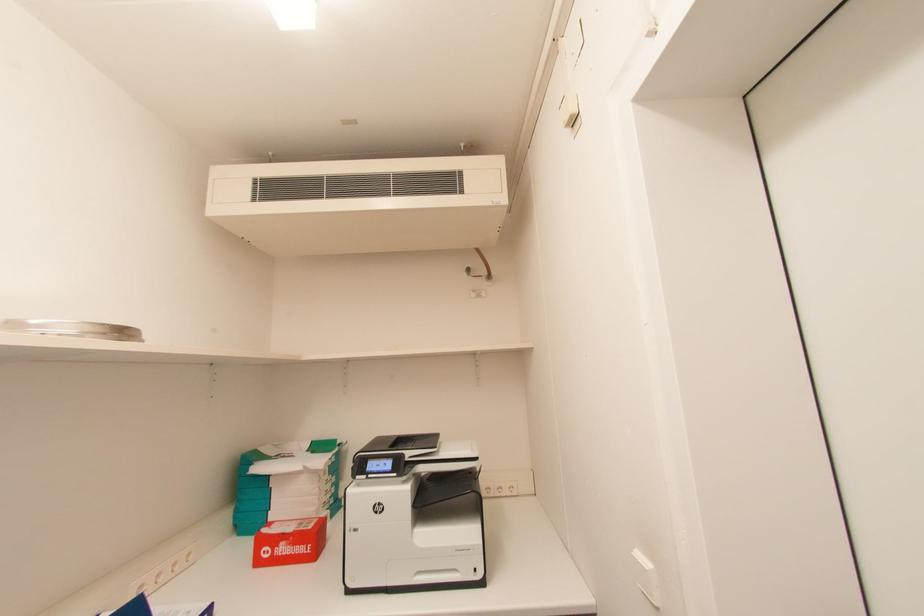
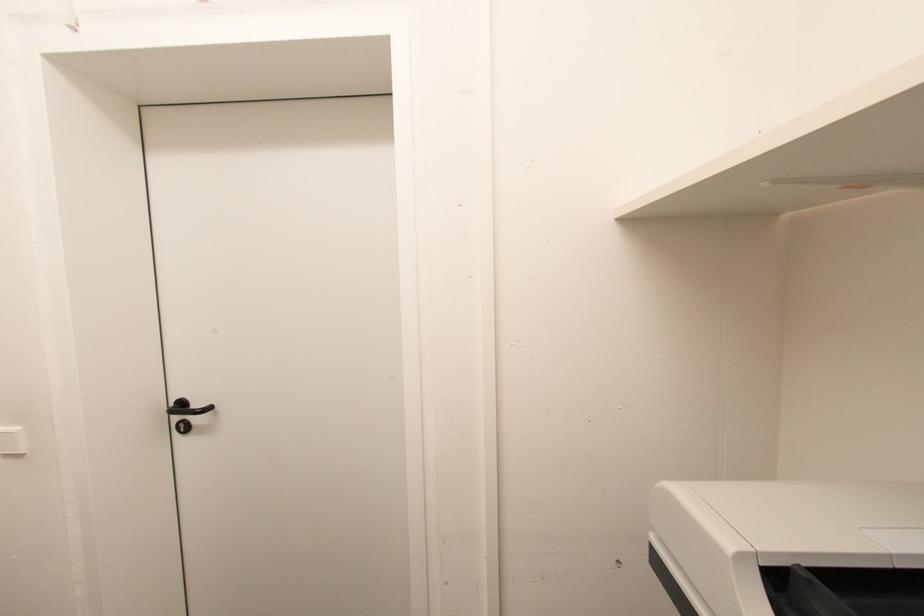
Question: The images are taken continuously from a first-person perspective. In which direction is your viewpoint rotating?

Choices:
 (A) Left
 (B) Right
 (C) Up
 (D) Down

Answer: (B)